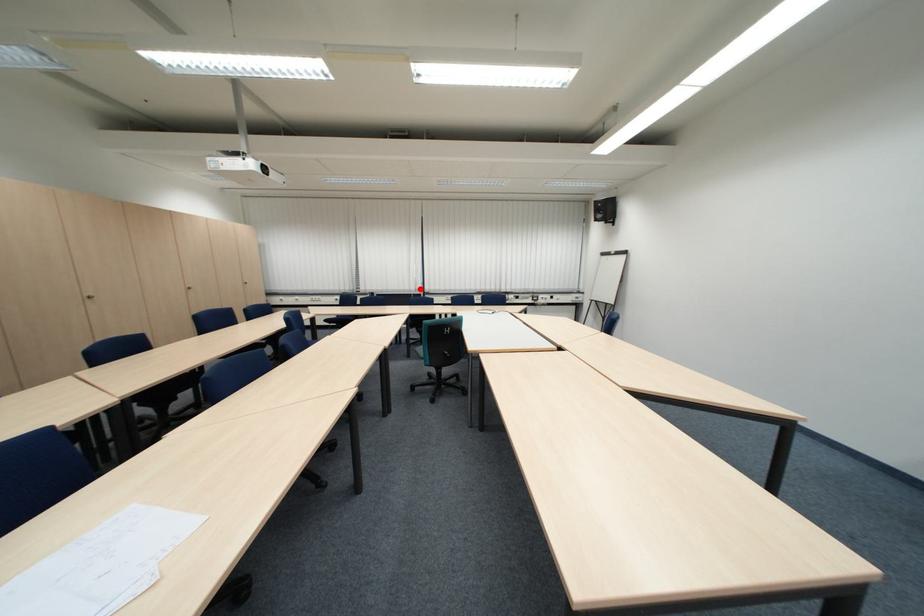
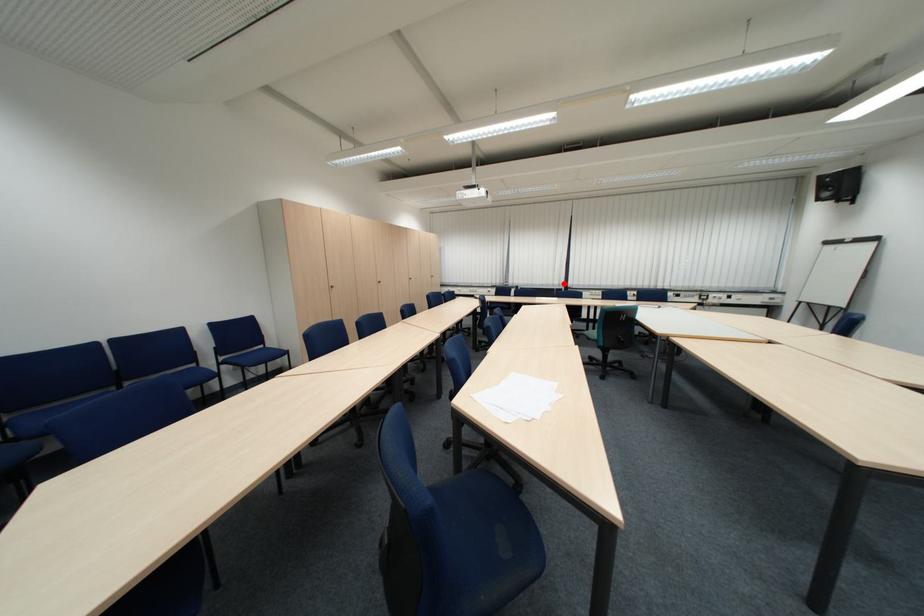
I am providing you with two images of the same scene from different viewpoints. A red point is marked on the first image and another point is marked on the second image. Is the marked point in image1 the same physical position as the marked point in image2?

Yes